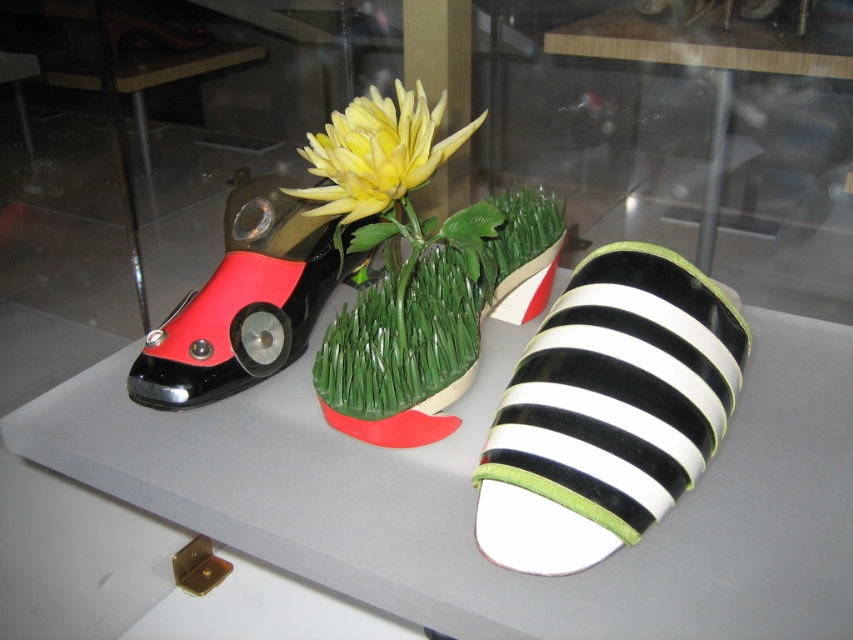
Question: Which point is closer to the camera?

Choices:
 (A) (412, 188)
 (B) (531, 445)

Answer: (B)

Question: Which of these objects is positioned closest to the shiny black plastic toy car at left?

Choices:
 (A) yellow matte flower at center
 (B) black and white striped sandal at center

Answer: (A)

Question: From the image, what is the correct spatial relationship of black and white striped sandal at center in relation to green grass at center?

Choices:
 (A) below
 (B) above

Answer: (A)

Question: Which point is closer to the camera?

Choices:
 (A) black and white striped sandal at center
 (B) shiny black plastic toy car at left
 (C) green grass at center
 (D) yellow matte flower at center

Answer: (A)

Question: Does green grass at center have a smaller size compared to yellow matte flower at center?

Choices:
 (A) no
 (B) yes

Answer: (A)

Question: Can you confirm if black and white striped sandal at center is positioned above yellow matte flower at center?

Choices:
 (A) yes
 (B) no

Answer: (B)